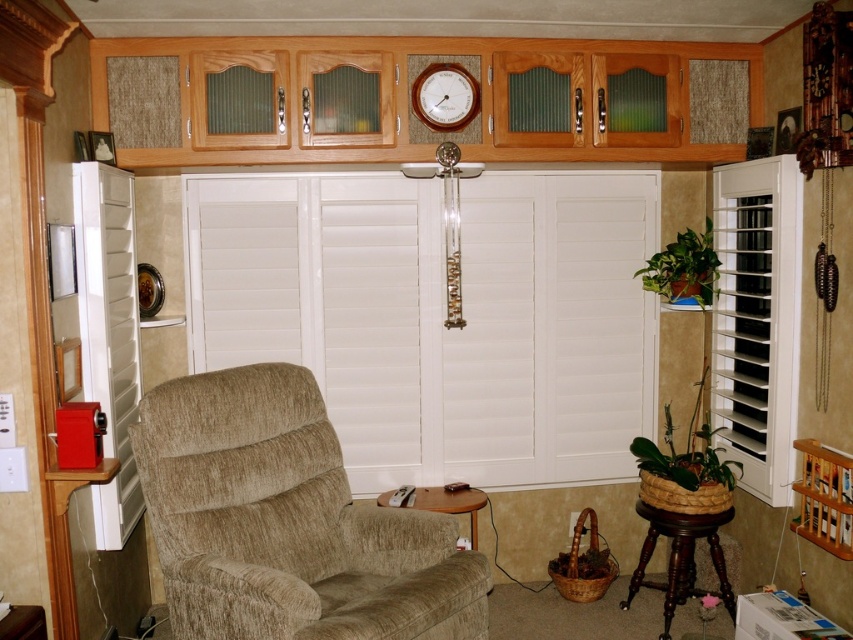
You are sitting in the beige upholstered recliner chair and want to adjust the white wood blinds at center. Based on their position, can you reach them without moving from the chair?

The white wood blinds at center are located at point coordinates that are likely above your head if you are sitting in the beige upholstered recliner chair. Since they are positioned above the seating area, you would need to stand or move closer to reach them.

You are trying to place a new decorative item on the brown wooden stool at lower right and the matte silver clock at upper center. Which surface can accommodate a wider object?

The brown wooden stool at lower right can accommodate a wider object since its width surpasses that of the matte silver clock at upper center.